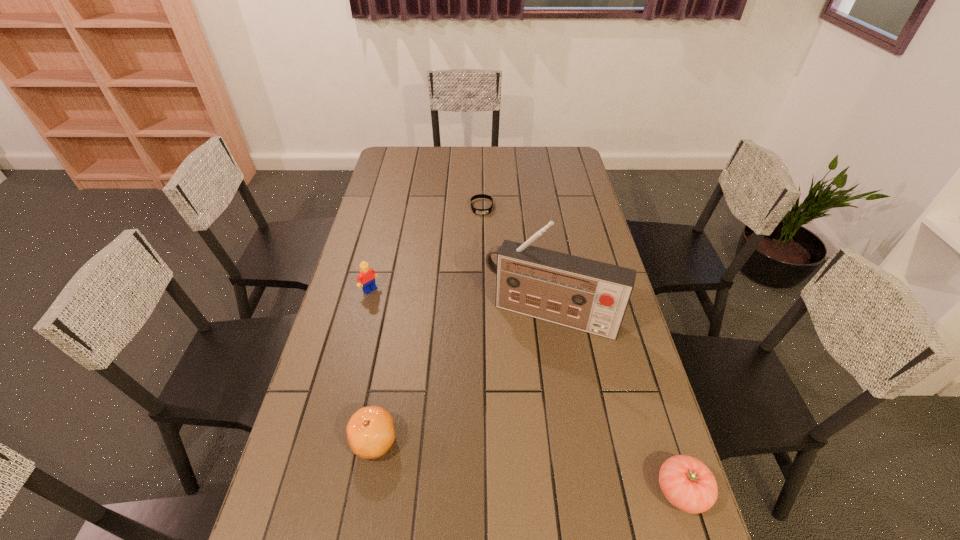
This screenshot has width=960, height=540. I want to click on free space located 0.200m on the display of the shortest object, so click(483, 248).

Identify the location of vacant area located 0.390m on the display of the shortest object. Image resolution: width=960 pixels, height=540 pixels. (485, 285).

Where is `vacant space located 0.220m on the front panel of the tallest object`? The height and width of the screenshot is (540, 960). vacant space located 0.220m on the front panel of the tallest object is located at coordinates (507, 401).

You are a GUI agent. You are given a task and a screenshot of the screen. Output one action in this format:
    pyautogui.click(x=<x>, y=<y>)
    Task: Click on the vacant area situated on the front panel of the tallest object
    
    Given the screenshot: What is the action you would take?
    pyautogui.click(x=506, y=404)

This screenshot has width=960, height=540. What are the coordinates of `vacant space located 0.210m on the front panel of the tallest object` in the screenshot? It's located at (509, 398).

The height and width of the screenshot is (540, 960). I want to click on vacant space located 0.360m on the face of the Lego, so click(x=446, y=361).

The height and width of the screenshot is (540, 960). Identify the location of free space located on the face of the Lego. (407, 323).

You are a GUI agent. You are given a task and a screenshot of the screen. Output one action in this format:
    pyautogui.click(x=<x>, y=<y>)
    Task: Click on the vacant space situated 0.320m on the face of the Lego
    
    Given the screenshot: What is the action you would take?
    pyautogui.click(x=438, y=353)

Find the location of a particular element. Image resolution: width=960 pixels, height=540 pixels. object that is positioned at the near edge is located at coordinates (688, 484).

Find the location of a particular element. This screenshot has height=540, width=960. clementine that is at the left edge is located at coordinates (370, 432).